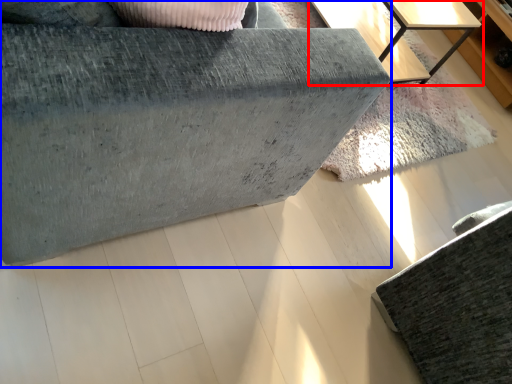
Question: Which point is further to the camera, table (highlighted by a red box) or furniture (highlighted by a blue box)?

Choices:
 (A) table
 (B) furniture

Answer: (A)